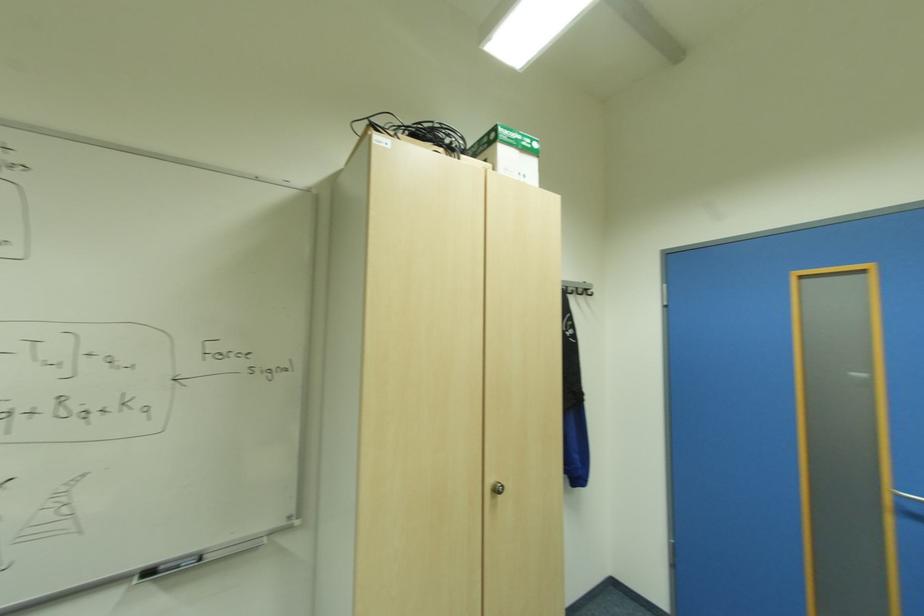
Find where to turn the silver cabinet knob. Please return your answer as a coordinate pair (x, y).

(496, 488)